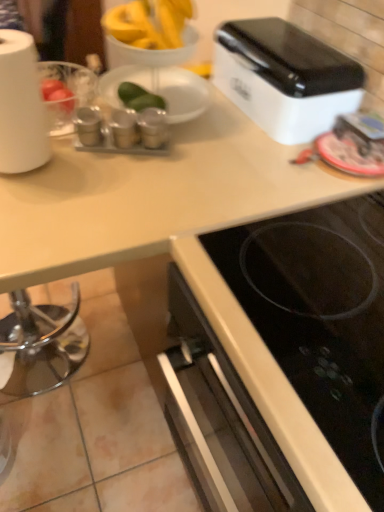
Question: Does metallic silver canisters at upper left, which is the 3th appliance in right-to-left order, appear on the right side of white glossy toaster at upper right?

Choices:
 (A) no
 (B) yes

Answer: (A)

Question: Could you tell me if metallic silver canisters at upper left, which is the 3th appliance in right-to-left order, is turned towards white glossy toaster at upper right?

Choices:
 (A) yes
 (B) no

Answer: (B)

Question: From the image's perspective, does metallic silver canisters at upper left, which is the 3th appliance in right-to-left order, appear higher than white glossy toaster at upper right?

Choices:
 (A) no
 (B) yes

Answer: (A)

Question: Can you confirm if metallic silver canisters at upper left, which is the 3th appliance in right-to-left order, is taller than white glossy toaster at upper right?

Choices:
 (A) no
 (B) yes

Answer: (A)

Question: From the image's perspective, would you say metallic silver canisters at upper left, which is the 3th appliance in right-to-left order, is shown under white glossy toaster at upper right?

Choices:
 (A) yes
 (B) no

Answer: (A)

Question: Is metallic silver canisters at upper left, the 1th appliance viewed from the left, far away from white glossy toaster at upper right?

Choices:
 (A) no
 (B) yes

Answer: (A)

Question: Does black glass cooktop at lower right have a lesser height compared to metallic silver spice containers at center, acting as the second appliance starting from the left?

Choices:
 (A) no
 (B) yes

Answer: (A)

Question: Are black glass cooktop at lower right and metallic silver spice containers at center, acting as the second appliance starting from the left, far apart?

Choices:
 (A) yes
 (B) no

Answer: (B)

Question: Considering the relative positions of black glass cooktop at lower right and metallic silver spice containers at center, acting as the second appliance starting from the left, in the image provided, is black glass cooktop at lower right to the left of metallic silver spice containers at center, acting as the second appliance starting from the left, from the viewer's perspective?

Choices:
 (A) no
 (B) yes

Answer: (A)

Question: Is black glass cooktop at lower right oriented away from metallic silver spice containers at center, which appears as the 2th appliance when viewed from the right?

Choices:
 (A) no
 (B) yes

Answer: (A)

Question: Does black glass cooktop at lower right lie behind metallic silver spice containers at center, which appears as the 2th appliance when viewed from the right?

Choices:
 (A) no
 (B) yes

Answer: (A)

Question: Does black glass cooktop at lower right have a larger size compared to metallic silver spice containers at center, which appears as the 2th appliance when viewed from the right?

Choices:
 (A) yes
 (B) no

Answer: (A)

Question: From the image's perspective, is metallic silver canisters at upper left, the 1th appliance viewed from the left, on top of metallic silver spice containers at center, which appears as the first appliance when viewed from the right?

Choices:
 (A) yes
 (B) no

Answer: (A)